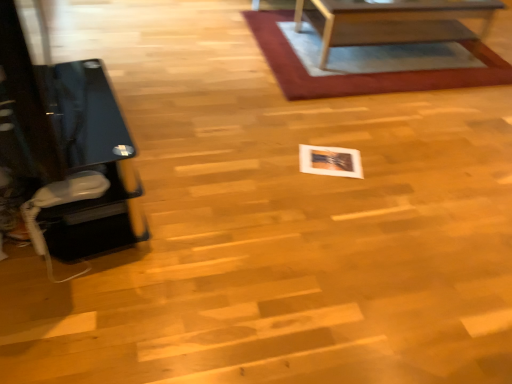
This screenshot has height=384, width=512. Identify the location of unoccupied space behind white glossy photo frame at center. pos(324,133).